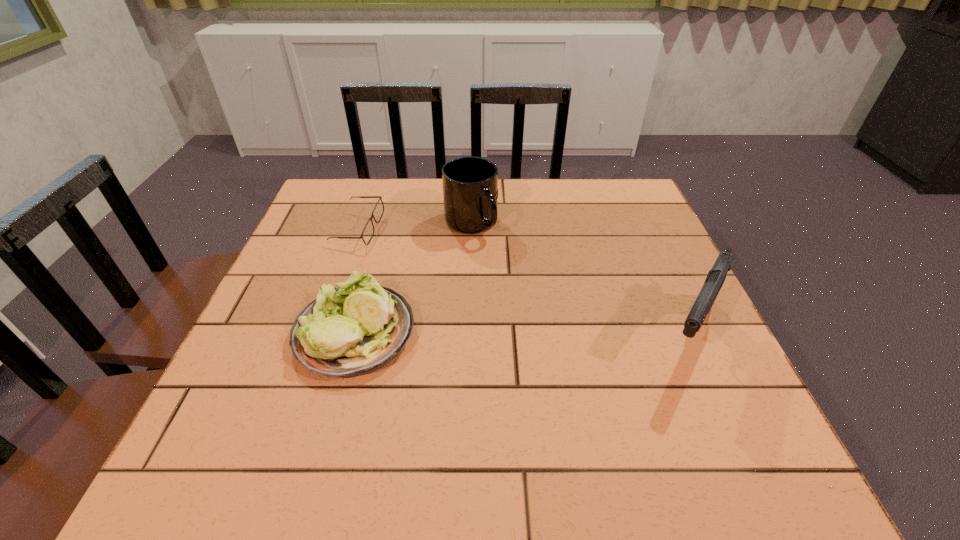
The width and height of the screenshot is (960, 540). I want to click on lettuce, so click(x=353, y=330).

The image size is (960, 540). What are the coordinates of `the rightmost object` in the screenshot? It's located at (716, 276).

You are a GUI agent. You are given a task and a screenshot of the screen. Output one action in this format:
    pyautogui.click(x=<x>, y=<y>)
    Task: Click on the mug
    
    Given the screenshot: What is the action you would take?
    pyautogui.click(x=470, y=184)

Locate an element on the screen. The height and width of the screenshot is (540, 960). the shortest object is located at coordinates (368, 231).

The image size is (960, 540). I want to click on free region located 0.130m on the back of the second shortest object, so click(376, 255).

At what (x,y) coordinates should I click in order to perform the action: click on free spot located at the muzzle of the rightmost object. Please return your answer as a coordinate pair (x, y). This screenshot has height=540, width=960. Looking at the image, I should click on (720, 406).

The height and width of the screenshot is (540, 960). In order to click on free space located 0.310m with the handle on the side of the mug in this screenshot , I will do `click(528, 330)`.

Locate an element on the screen. This screenshot has width=960, height=540. free space located 0.340m with the handle on the side of the mug is located at coordinates (534, 341).

Locate an element on the screen. The image size is (960, 540). vacant space located 0.240m with the handle on the side of the mug is located at coordinates (515, 306).

Locate an element on the screen. free spot located with the lenses facing outward on the shortest object is located at coordinates (399, 254).